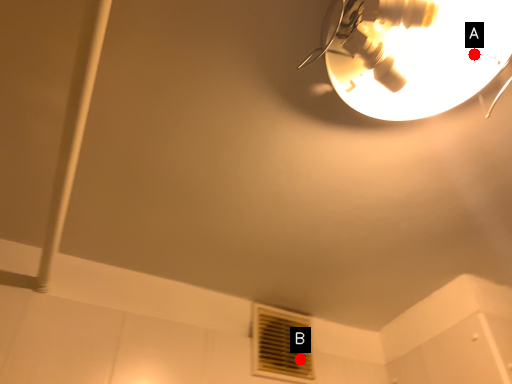
Question: Two points are circled on the image, labeled by A and B beside each circle. Which point is farther to the camera?

Choices:
 (A) A is further
 (B) B is further

Answer: (B)